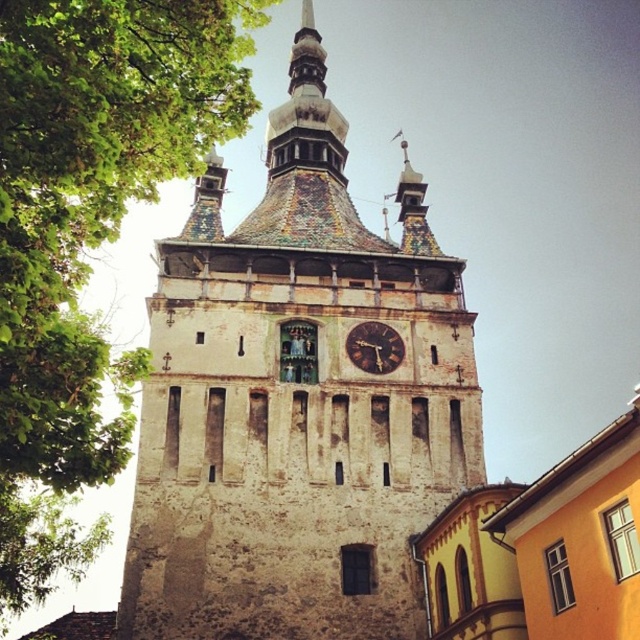
Who is higher up, weathered stone clock tower at center or brown wooden clock at center?

weathered stone clock tower at center

Who is lower down, weathered stone clock tower at center or brown wooden clock at center?

brown wooden clock at center

Between point (198, 346) and point (371, 356), which one is positioned in front?

Point (198, 346) is more forward.

Identify the location of weathered stone clock tower at center. (296, 403).

Who is more distant from viewer, (472,428) or (61,284)?

Positioned behind is point (472,428).

Is weathered stone clock tower at center shorter than green leafy tree at upper left?

In fact, weathered stone clock tower at center may be taller than green leafy tree at upper left.

Identify the location of weathered stone clock tower at center. The image size is (640, 640). (296, 403).

Is green leafy tree at upper left to the right of brown wooden clock at center from the viewer's perspective?

In fact, green leafy tree at upper left is to the left of brown wooden clock at center.

Which of these two, green leafy tree at upper left or brown wooden clock at center, stands shorter?

brown wooden clock at center is shorter.

Locate an element on the screen. This screenshot has height=640, width=640. green leafy tree at upper left is located at coordinates (88, 234).